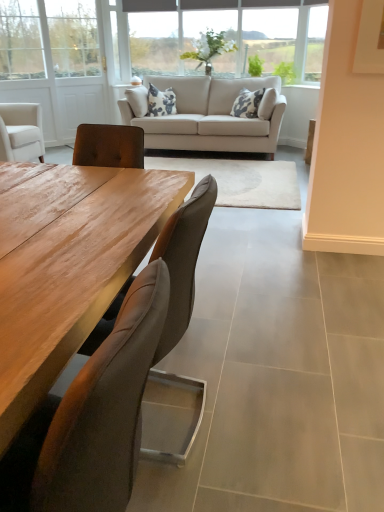
Question: Which direction should I rotate to face clear glass vase at upper center, which appears as the first window when viewed from the right, — up or down?

Choices:
 (A) up
 (B) down

Answer: (A)

Question: Does white wood screen door at upper left come in front of leather cushioned chair at center, the 1th chair positioned from the front?

Choices:
 (A) no
 (B) yes

Answer: (A)

Question: Could leather cushioned chair at center, the 1th chair positioned from the front, be considered to be inside white wood screen door at upper left?

Choices:
 (A) no
 (B) yes

Answer: (A)

Question: From a real-world perspective, is white wood screen door at upper left physically above leather cushioned chair at center, the 2th chair when ordered from back to front?

Choices:
 (A) yes
 (B) no

Answer: (A)

Question: Is white wood screen door at upper left in contact with leather cushioned chair at center, the 2th chair when ordered from back to front?

Choices:
 (A) no
 (B) yes

Answer: (A)

Question: Is white wood screen door at upper left wider than leather cushioned chair at center, the 1th chair positioned from the front?

Choices:
 (A) no
 (B) yes

Answer: (A)

Question: From the image's perspective, is white wood screen door at upper left beneath leather cushioned chair at center, the 1th chair positioned from the front?

Choices:
 (A) no
 (B) yes

Answer: (A)

Question: Is white wood screen door at upper left smaller than clear glass vase at upper center, which appears as the first window when viewed from the right?

Choices:
 (A) no
 (B) yes

Answer: (A)

Question: Is white wood screen door at upper left bigger than clear glass vase at upper center, which appears as the first window when viewed from the right?

Choices:
 (A) no
 (B) yes

Answer: (B)

Question: From a real-world perspective, does white wood screen door at upper left stand above clear glass vase at upper center, the 2th window when ordered from left to right?

Choices:
 (A) no
 (B) yes

Answer: (A)

Question: Can you confirm if white wood screen door at upper left is shorter than clear glass vase at upper center, the 2th window when ordered from left to right?

Choices:
 (A) yes
 (B) no

Answer: (B)

Question: From a real-world perspective, is white wood screen door at upper left located beneath clear glass vase at upper center, which appears as the first window when viewed from the right?

Choices:
 (A) yes
 (B) no

Answer: (A)

Question: Is the depth of white wood screen door at upper left greater than that of clear glass vase at upper center, which appears as the first window when viewed from the right?

Choices:
 (A) yes
 (B) no

Answer: (B)

Question: Is leather cushioned chair at center, the 2th chair when ordered from back to front, surrounded by beige fabric couch at center?

Choices:
 (A) yes
 (B) no

Answer: (B)